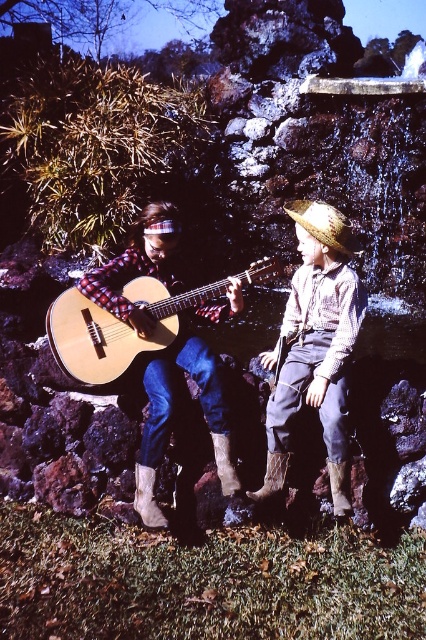
Which is below, rustic straw hat at center or light brown acoustic guitar at center?

rustic straw hat at center

Does rustic straw hat at center appear under light brown acoustic guitar at center?

Correct, rustic straw hat at center is located below light brown acoustic guitar at center.

The height and width of the screenshot is (640, 426). Describe the element at coordinates (316, 348) in the screenshot. I see `rustic straw hat at center` at that location.

This screenshot has height=640, width=426. Identify the location of rustic straw hat at center. (316, 348).

Is rustic straw hat at center further to camera compared to brown woven leather cowboy boot at lower center?

No.

You are a GUI agent. You are given a task and a screenshot of the screen. Output one action in this format:
    pyautogui.click(x=<x>, y=<y>)
    Task: Click on the rustic straw hat at center
    This screenshot has height=640, width=426.
    Given the screenshot: What is the action you would take?
    pyautogui.click(x=316, y=348)

Which is in front, point (322, 317) or point (268, 460)?

Positioned in front is point (268, 460).

Where is `rustic straw hat at center`? rustic straw hat at center is located at coordinates click(x=316, y=348).

Is the position of strawmaterial/texturehat at upper center more distant than that of brown suede cowboy boot at lower center?

No, it is in front of brown suede cowboy boot at lower center.

Does strawmaterial/texturehat at upper center appear on the left side of brown suede cowboy boot at lower center?

Incorrect, strawmaterial/texturehat at upper center is not on the left side of brown suede cowboy boot at lower center.

Between point (350, 221) and point (221, 449), which one is positioned in front?

Point (221, 449) is in front.

This screenshot has width=426, height=640. Find the location of `strawmaterial/texturehat at upper center`. strawmaterial/texturehat at upper center is located at coordinates (325, 225).